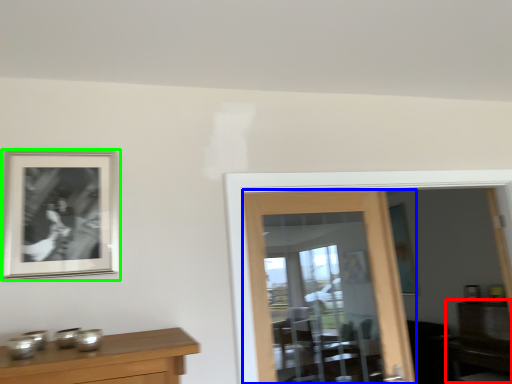
Question: Which object is the farthest from dresser (highlighted by a red box)? Choose among these: door (highlighted by a blue box) or picture frame (highlighted by a green box).

Choices:
 (A) door
 (B) picture frame

Answer: (B)